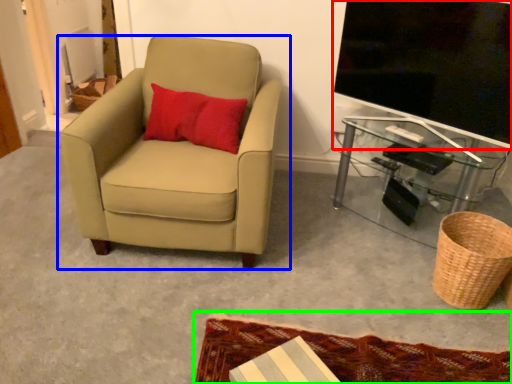
Question: Which object is the farthest from television (highlighted by a red box)? Choose among these: chair (highlighted by a blue box) or mat (highlighted by a green box).

Choices:
 (A) chair
 (B) mat

Answer: (B)